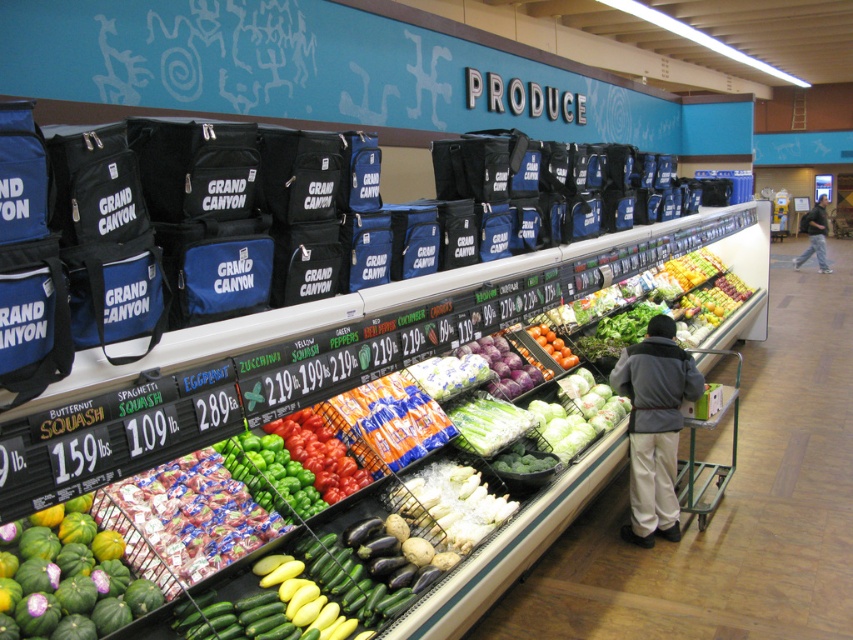
You are a grocery store employee who needs to place a new sign between the gray fleece jacket at center and the green matte bell peppers at center. The sign is 1.5 meters long. Will there be enough space to place the sign between them?

The gray fleece jacket at center is 2.14 meters from the green matte bell peppers at center. Since the sign is only 1.5 meters long, there is enough space to place the sign between them.

Based on the photo, you are a customer in the grocery store looking at the produce section. You see the green matte bell peppers at center and the dark gray hoodie at center. Which item is positioned closer to you?

The green matte bell peppers at center are closer to the viewer than the dark gray hoodie at center.